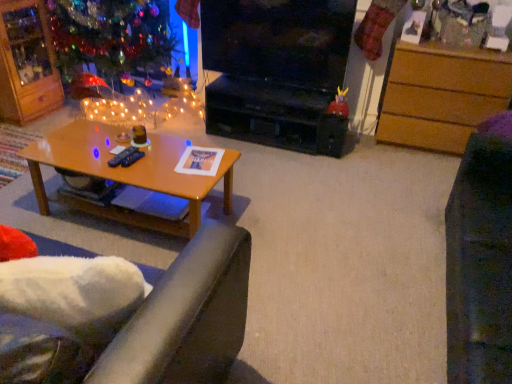
You are a GUI agent. You are given a task and a screenshot of the screen. Output one action in this format:
    pyautogui.click(x=<x>, y=<y>)
    Task: Click on the satin blue remote control at center, which is counted as the second remote control, starting from the right
    The height and width of the screenshot is (384, 512).
    Given the screenshot: What is the action you would take?
    pyautogui.click(x=121, y=156)

The height and width of the screenshot is (384, 512). In order to click on black plastic remote control at center, the 2th remote control viewed from the left in this screenshot , I will do `click(132, 158)`.

Describe the element at coordinates (481, 259) in the screenshot. The height and width of the screenshot is (384, 512). I see `velvet purple swivel chair at right` at that location.

Measure the distance between point (447, 373) and camera.

A distance of 4.98 feet exists between point (447, 373) and camera.

The image size is (512, 384). Find the location of `black matte entertainment center at center`. black matte entertainment center at center is located at coordinates (274, 115).

What is the approximate height of wooden cabinet at upper left?

36.10 inches.

Where is `wooden cabinet at upper left`? The height and width of the screenshot is (384, 512). wooden cabinet at upper left is located at coordinates (27, 63).

Locate an element on the screen. satin blue remote control at center, which is counted as the second remote control, starting from the right is located at coordinates (121, 156).

Which is more to the left, wooden coffee table at center or white fluffy couch at lower left?

Positioned to the left is wooden coffee table at center.

Based on the photo, considering the relative sizes of wooden coffee table at center and white fluffy couch at lower left in the image provided, is wooden coffee table at center wider than white fluffy couch at lower left?

Correct, the width of wooden coffee table at center exceeds that of white fluffy couch at lower left.

From a real-world perspective, is wooden coffee table at center above or below white fluffy couch at lower left?

wooden coffee table at center is below white fluffy couch at lower left.

From the image's perspective, is wooden coffee table at center on white fluffy couch at lower left?

Yes.

Considering the sizes of shiny glass christmas tree at upper left and wooden cabinet at upper left in the image, is shiny glass christmas tree at upper left wider or thinner than wooden cabinet at upper left?

shiny glass christmas tree at upper left is wider than wooden cabinet at upper left.

Is shiny glass christmas tree at upper left not within wooden cabinet at upper left?

Indeed, shiny glass christmas tree at upper left is completely outside wooden cabinet at upper left.

Is shiny glass christmas tree at upper left taller than wooden cabinet at upper left?

Indeed, shiny glass christmas tree at upper left has a greater height compared to wooden cabinet at upper left.

Which object is further away from the camera taking this photo, shiny glass christmas tree at upper left or wooden cabinet at upper left?

wooden cabinet at upper left is further from the camera.

Find the location of a particular element. The width and height of the screenshot is (512, 384). desk behind the white fluffy couch at lower left is located at coordinates (441, 95).

Considering the relative sizes of wooden drawer at right and white fluffy couch at lower left in the image provided, is wooden drawer at right shorter than white fluffy couch at lower left?

Incorrect, the height of wooden drawer at right does not fall short of that of white fluffy couch at lower left.

Considering the sizes of wooden drawer at right and white fluffy couch at lower left in the image, is wooden drawer at right wider or thinner than white fluffy couch at lower left?

wooden drawer at right is wider than white fluffy couch at lower left.

Which is behind, black glossy television at center or wooden coffee table at center?

black glossy television at center is behind.

From the image's perspective, does black glossy television at center appear lower than wooden coffee table at center?

No, from the image's perspective, black glossy television at center is not below wooden coffee table at center.

Which is nearer, (207, 7) or (188, 229)?

Positioned in front is point (188, 229).

Does black glossy television at center have a larger size compared to wooden coffee table at center?

Incorrect, black glossy television at center is not larger than wooden coffee table at center.

Considering the positions of objects wooden coffee table at center and shiny red toy at center in the image provided, who is more to the right, wooden coffee table at center or shiny red toy at center?

shiny red toy at center is more to the right.

In terms of size, does wooden coffee table at center appear bigger or smaller than shiny red toy at center?

Clearly, wooden coffee table at center is larger in size than shiny red toy at center.

From the image's perspective, which one is positioned lower, wooden coffee table at center or shiny red toy at center?

wooden coffee table at center is shown below in the image.

Is wooden coffee table at center wider or thinner than shiny red toy at center?

Clearly, wooden coffee table at center has more width compared to shiny red toy at center.

Does wooden coffee table at center lie in front of black glossy television at center?

Yes, it is.

Which object is thinner, wooden coffee table at center or black glossy television at center?

black glossy television at center is thinner.

From a real-world perspective, which object stands above the other?

black glossy television at center, from a real-world perspective.

Which of these two, wooden coffee table at center or black glossy television at center, stands shorter?

Standing shorter between the two is wooden coffee table at center.

Is wooden drawer at right far from black matte entertainment center at center?

No, wooden drawer at right is not far away from black matte entertainment center at center.

Could you tell me if wooden drawer at right is turned towards black matte entertainment center at center?

No, wooden drawer at right is not facing towards black matte entertainment center at center.

Which object is positioned more to the right, wooden drawer at right or black matte entertainment center at center?

wooden drawer at right is more to the right.

From the picture: From the image's perspective, does wooden drawer at right appear higher than black matte entertainment center at center?

Yes, from the image's perspective, wooden drawer at right is above black matte entertainment center at center.

This screenshot has width=512, height=384. I want to click on coffee table directly beneath the white fluffy couch at lower left (from a real-world perspective), so click(x=126, y=173).

Locate an element on the screen. christmas tree positioned vertically above the wooden cabinet at upper left (from a real-world perspective) is located at coordinates (112, 37).

Considering their positions, is black glossy television at center positioned closer to white fluffy couch at lower left than shiny red toy at center?

shiny red toy at center lies closer to white fluffy couch at lower left than the other object.

When comparing their distances from matte brown coffee cup at center, does shiny red toy at center or velvet purple swivel chair at right seem closer?

The object closer to matte brown coffee cup at center is shiny red toy at center.

Looking at the image, which one is located further to black glossy television at center, shiny glass christmas tree at upper left or matte brown coffee cup at center?

Among the two, matte brown coffee cup at center is located further to black glossy television at center.

Estimate the real-world distances between objects in this image. Which object is closer to black matte entertainment center at center, black plastic remote control at center, the 1th remote control positioned from the right, or wooden drawer at right?

wooden drawer at right is positioned closer to the anchor black matte entertainment center at center.

Considering their positions, is satin blue remote control at center, which is the 1th remote control from left to right, positioned closer to wooden cabinet at upper left than shiny glass christmas tree at upper left?

Based on the image, shiny glass christmas tree at upper left appears to be nearer to wooden cabinet at upper left.

From the image, which object appears to be farther from white fluffy couch at lower left, black glossy television at center or wooden coffee table at center?

black glossy television at center lies further to white fluffy couch at lower left than the other object.

Looking at the image, which one is located closer to white fluffy couch at lower left, wooden coffee table at center or black matte entertainment center at center?

wooden coffee table at center.

Based on their spatial positions, is matte brown coffee cup at center or velvet purple swivel chair at right further from wooden coffee table at center?

Among the two, velvet purple swivel chair at right is located further to wooden coffee table at center.

Image resolution: width=512 pixels, height=384 pixels. I want to click on christmas tree positioned between velvet purple swivel chair at right and shiny red toy at center from near to far, so click(x=112, y=37).

Where is `television situated between black plastic remote control at center, the 1th remote control positioned from the right, and wooden drawer at right from left to right`? Image resolution: width=512 pixels, height=384 pixels. television situated between black plastic remote control at center, the 1th remote control positioned from the right, and wooden drawer at right from left to right is located at coordinates (278, 40).

The image size is (512, 384). Find the location of `coffee cup located between wooden cabinet at upper left and wooden drawer at right in the left-right direction`. coffee cup located between wooden cabinet at upper left and wooden drawer at right in the left-right direction is located at coordinates (139, 134).

This screenshot has width=512, height=384. I want to click on coffee table between satin blue remote control at center, which is counted as the second remote control, starting from the right, and velvet purple swivel chair at right, in the horizontal direction, so click(x=126, y=173).